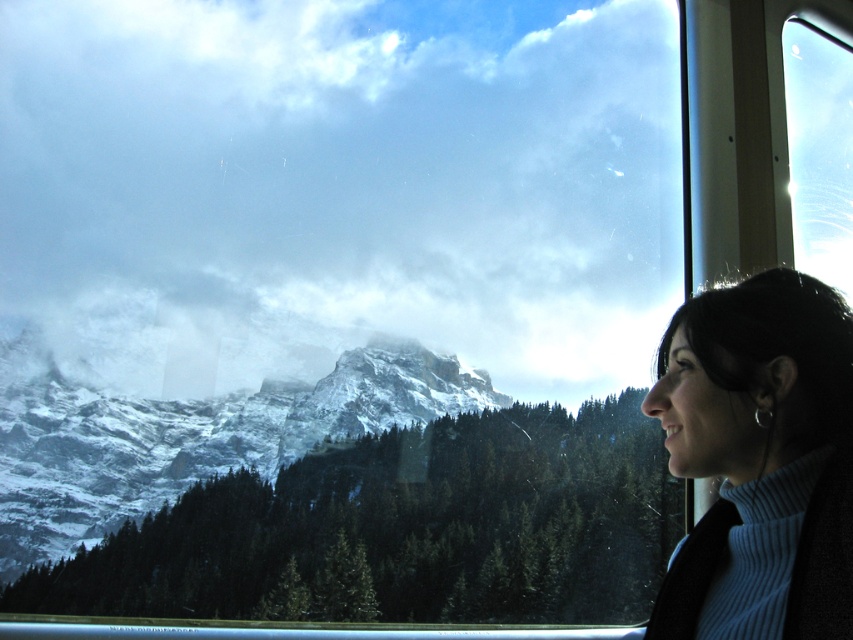
Between light blue turtleneck sweater at right and transparent glass window at upper right, which one has more height?

transparent glass window at upper right

Does light blue turtleneck sweater at right have a lesser height compared to transparent glass window at upper right?

Yes, light blue turtleneck sweater at right is shorter than transparent glass window at upper right.

At what (x,y) coordinates should I click in order to perform the action: click on light blue turtleneck sweater at right. Please return your answer as a coordinate pair (x, y). Looking at the image, I should click on (775, 420).

Consider the image. Which is above, snowy rock mountain at center or light blue turtleneck sweater at right?

light blue turtleneck sweater at right is higher up.

Does point (222, 465) come behind point (840, 566)?

Yes, it is.

Identify the location of snowy rock mountain at center. The image size is (853, 640). (194, 438).

What are the coordinates of `snowy rock mountain at center` in the screenshot? It's located at (194, 438).

Between point (258, 442) and point (817, 212), which one is positioned behind?

The point (817, 212) is behind.

Is point (131, 515) more distant than point (801, 67)?

No, (131, 515) is closer to viewer.

Where is `snowy rock mountain at center`? The width and height of the screenshot is (853, 640). snowy rock mountain at center is located at coordinates (194, 438).